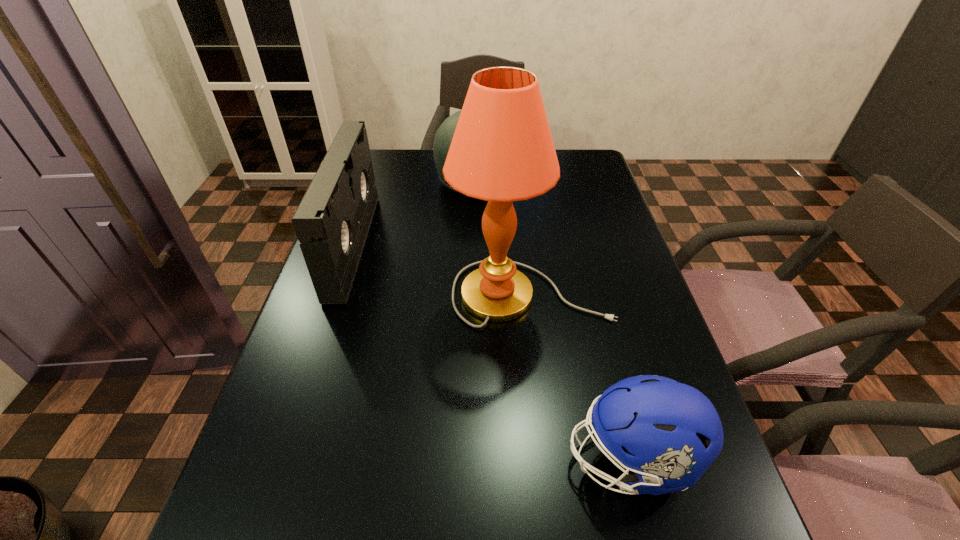
You are a GUI agent. You are given a task and a screenshot of the screen. Output one action in this format:
    pyautogui.click(x=<x>, y=<y>)
    Task: Click on the tallest object
    This screenshot has width=960, height=540.
    Given the screenshot: What is the action you would take?
    pyautogui.click(x=502, y=150)

This screenshot has width=960, height=540. I want to click on videotape, so click(332, 221).

This screenshot has width=960, height=540. What are the coordinates of `the left football helmet` in the screenshot? It's located at (444, 135).

Where is `the farther football helmet`? The image size is (960, 540). the farther football helmet is located at coordinates (444, 135).

This screenshot has height=540, width=960. Find the location of `the right football helmet`. the right football helmet is located at coordinates (668, 433).

You are a GUI agent. You are given a task and a screenshot of the screen. Output one action in this format:
    pyautogui.click(x=<x>, y=<y>)
    Task: Click on the shorter football helmet
    The image size is (960, 540).
    Given the screenshot: What is the action you would take?
    pyautogui.click(x=668, y=433)

Locate an element on the screen. This screenshot has height=540, width=960. free space located on the back of the tallest object is located at coordinates (522, 227).

The image size is (960, 540). I want to click on free location located 0.290m on the side of the videotape with visible spindles, so click(x=474, y=245).

This screenshot has height=540, width=960. I want to click on vacant position located at the face opening of the taller football helmet, so click(x=529, y=183).

I want to click on vacant space located 0.130m on the face guard of the nearest object, so click(490, 459).